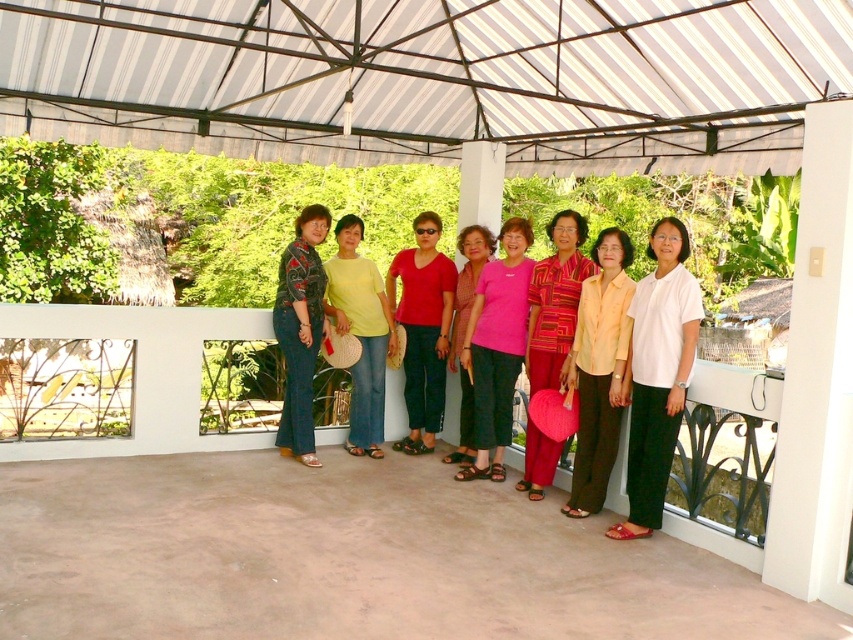
How far apart are pink fabric shirt at center and matte red shirt at center?

pink fabric shirt at center is 27.16 inches away from matte red shirt at center.

Is point (479, 332) in front of point (451, 273)?

That is True.

Is point (485, 307) positioned in front of point (418, 260)?

That is True.

Locate an element on the screen. This screenshot has width=853, height=640. pink fabric shirt at center is located at coordinates (497, 348).

Between white matte blouse at center and textured pink fabric at center, which one has less height?

white matte blouse at center is shorter.

Is white matte blouse at center taller than textured pink fabric at center?

No.

Which is in front, point (651, 234) or point (577, 220)?

Point (651, 234)

Where is `white matte blouse at center`? This screenshot has width=853, height=640. white matte blouse at center is located at coordinates (657, 374).

Consider the image. Who is positioned more to the right, matte yellow blouse at center or textured pink fabric at center?

From the viewer's perspective, matte yellow blouse at center appears more on the right side.

Describe the element at coordinates (599, 371) in the screenshot. I see `matte yellow blouse at center` at that location.

Where is `matte yellow blouse at center`? matte yellow blouse at center is located at coordinates (599, 371).